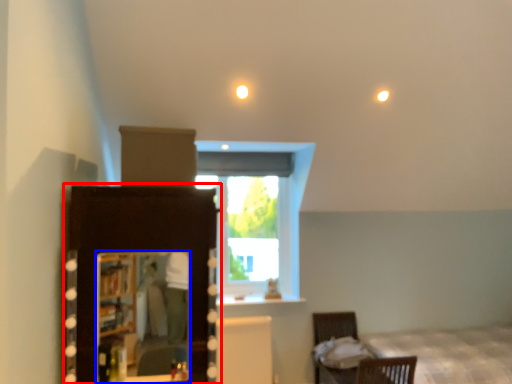
Question: Among these objects, which one is farthest to the camera, dresser (highlighted by a red box) or mirror (highlighted by a blue box)?

Choices:
 (A) dresser
 (B) mirror

Answer: (B)